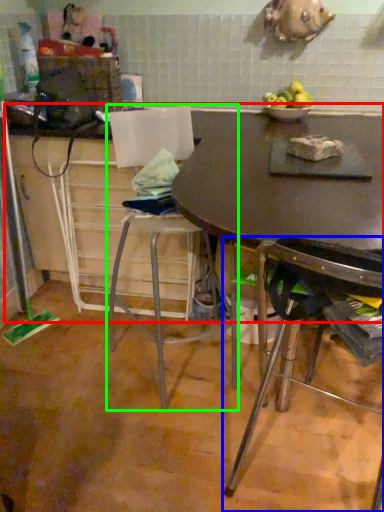
Question: Estimate the real-world distances between objects in this image. Which object is closer to counter top (highlighted by a red box), chair (highlighted by a blue box) or chair (highlighted by a green box)?

Choices:
 (A) chair
 (B) chair

Answer: (A)